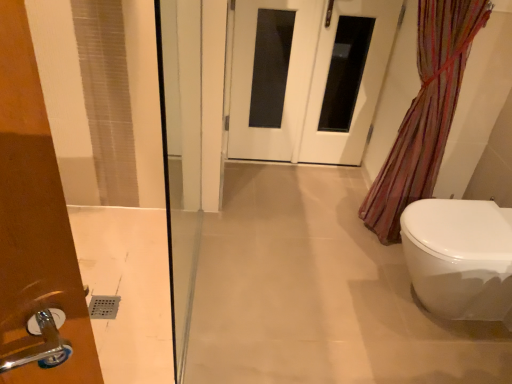
At what (x,y) coordinates should I click in order to perform the action: click on free spot to the left of white glossy toilet at lower right. Please return your answer as a coordinate pair (x, y). This screenshot has width=512, height=384. Looking at the image, I should click on (340, 299).